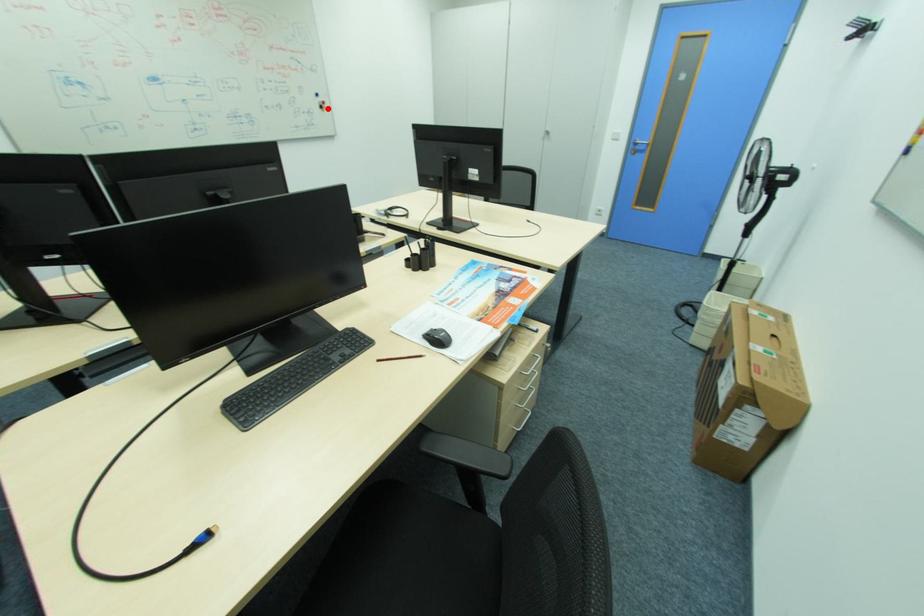
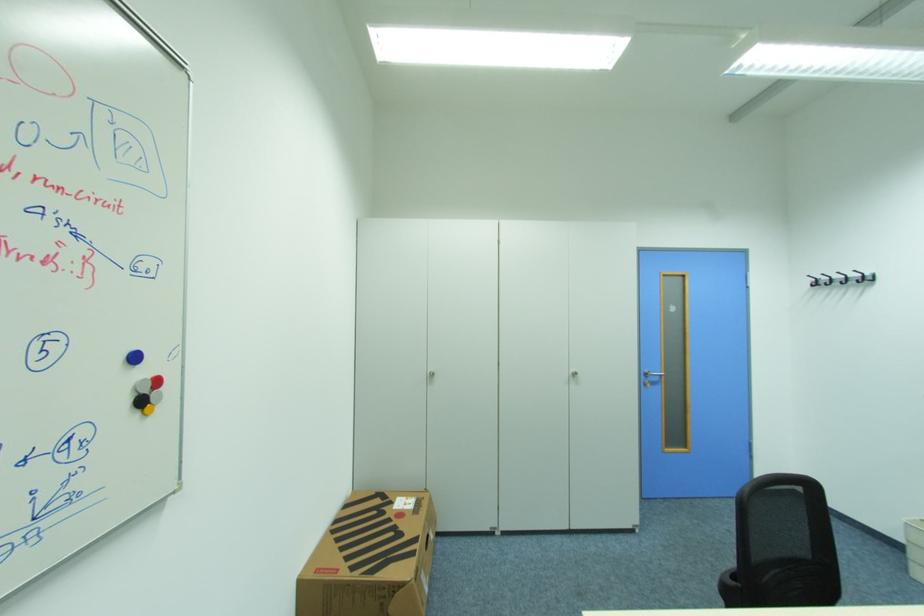
Locate, in the second image, the point that corresponds to the highlighted location in the first image.

(146, 403)